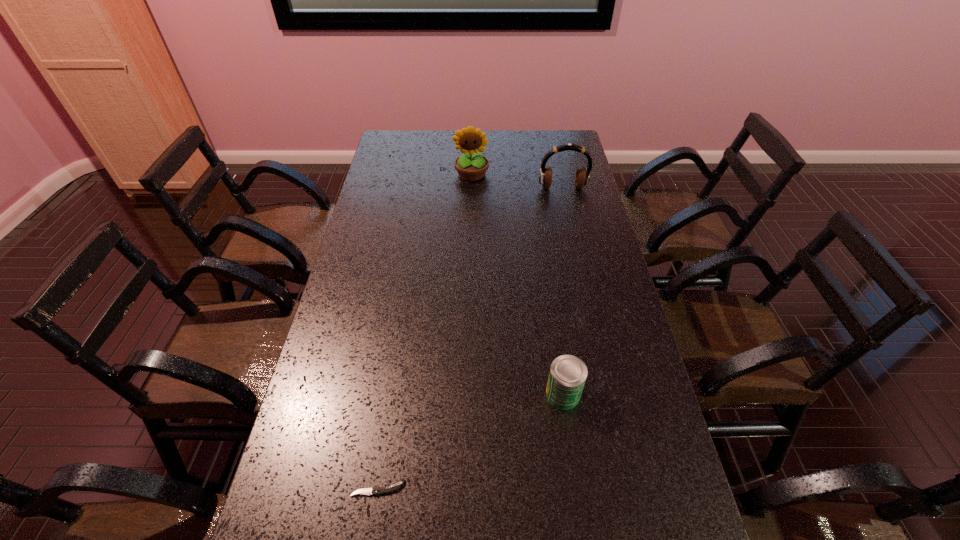
The image size is (960, 540). I want to click on free point between the second nearest object and the headset, so click(563, 291).

Locate an element on the screen. This screenshot has height=540, width=960. empty space that is in between the third object from right to left and the third tallest object is located at coordinates (517, 284).

This screenshot has height=540, width=960. Find the location of `unoccupied area between the sunflower and the nearest object`. unoccupied area between the sunflower and the nearest object is located at coordinates (424, 331).

In order to click on free space between the can and the shortest object in this screenshot , I will do `click(470, 441)`.

The height and width of the screenshot is (540, 960). In order to click on free space between the sunflower and the headset in this screenshot , I will do `click(517, 181)`.

I want to click on vacant space that's between the third farthest object and the second object from left to right, so click(517, 284).

I want to click on free space between the headset and the second nearest object, so click(563, 291).

Find the location of `the third closest object to the leftmost object`. the third closest object to the leftmost object is located at coordinates (582, 177).

You are a GUI agent. You are given a task and a screenshot of the screen. Output one action in this format:
    pyautogui.click(x=<x>, y=<y>)
    Task: Click on the third closest object to the shortest object
    This screenshot has width=960, height=540.
    Given the screenshot: What is the action you would take?
    pyautogui.click(x=582, y=177)

The height and width of the screenshot is (540, 960). Identify the location of vacant area that satisfies the following two spatial constraints: 1. on the back side of the pocketknife; 2. on the left side of the third tallest object. (392, 394).